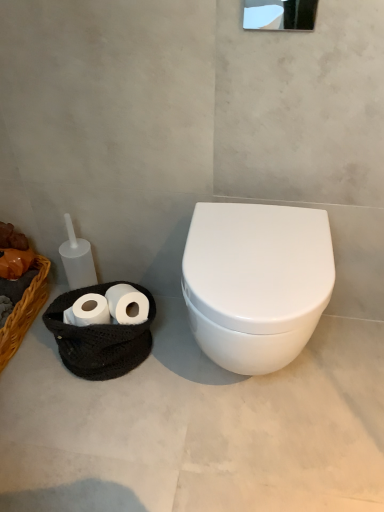
This screenshot has height=512, width=384. In order to click on empty space that is ontop of white matte toilet paper at lower left (from a real-world perspective) in this screenshot , I will do `click(99, 310)`.